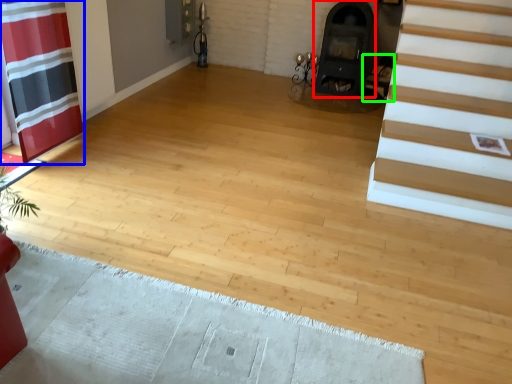
Question: Considering the real-world distances, which object is closest to fireplace (highlighted by a red box)? curtain (highlighted by a blue box) or armchair (highlighted by a green box).

Choices:
 (A) curtain
 (B) armchair

Answer: (B)